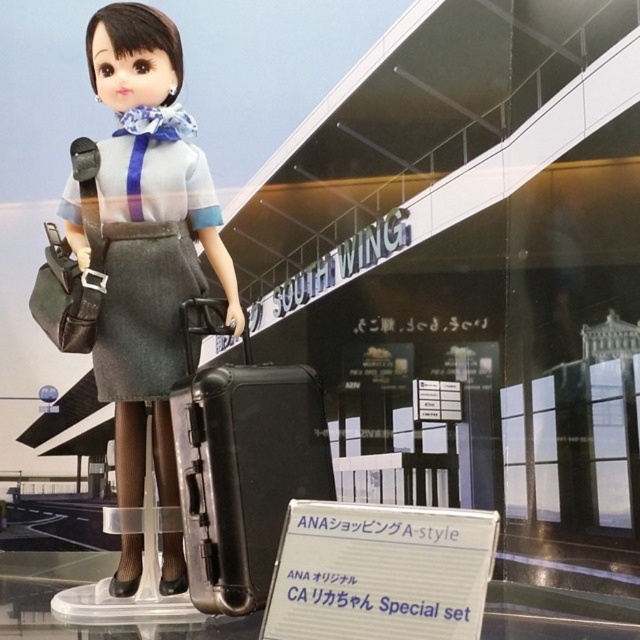
Question: Which point is closer to the camera?

Choices:
 (A) black hard suitcase at center
 (B) matte black suitcase at lower center
 (C) denim skirt at center

Answer: (A)

Question: Which point is closer to the camera taking this photo?

Choices:
 (A) (108, 196)
 (B) (192, 490)

Answer: (B)

Question: Can you confirm if matte black suitcase at lower center is positioned to the right of denim skirt at center?

Choices:
 (A) yes
 (B) no

Answer: (A)

Question: Does matte black suitcase at lower center appear under denim skirt at center?

Choices:
 (A) no
 (B) yes

Answer: (B)

Question: Does matte black suitcase at lower center have a greater width compared to black hard suitcase at center?

Choices:
 (A) no
 (B) yes

Answer: (B)

Question: Which object appears closest to the camera in this image?

Choices:
 (A) denim skirt at center
 (B) matte black suitcase at lower center
 (C) black hard suitcase at center

Answer: (C)